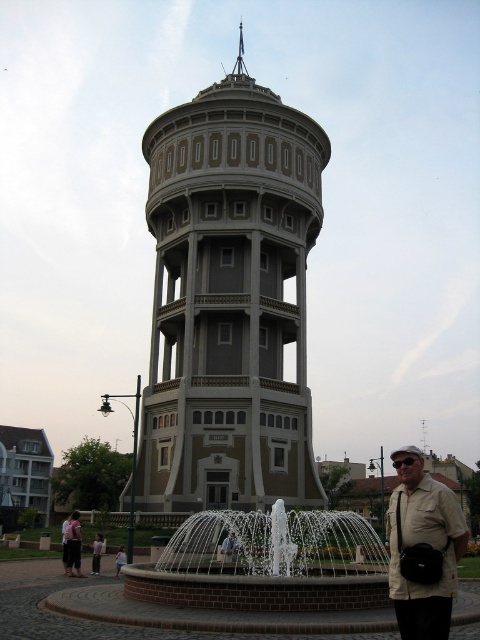
You are standing at the center of the public square in front of the water tower. You need to locate the beige fabric shirt at lower right. Based on the coordinates provided, where should you look relative to your position?

The beige fabric shirt at lower right is located at coordinates point (422, 544), which is to the lower right direction from your central position in the square.